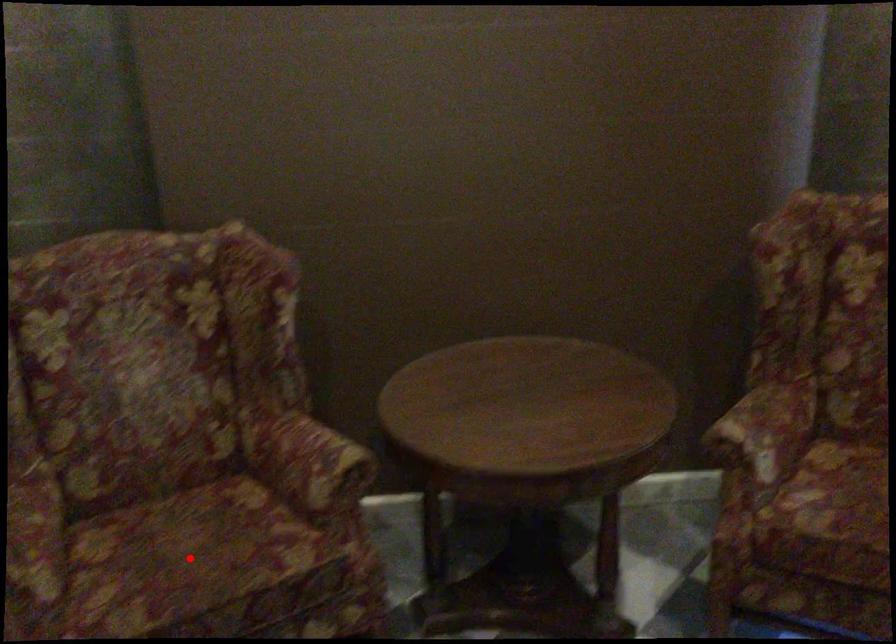
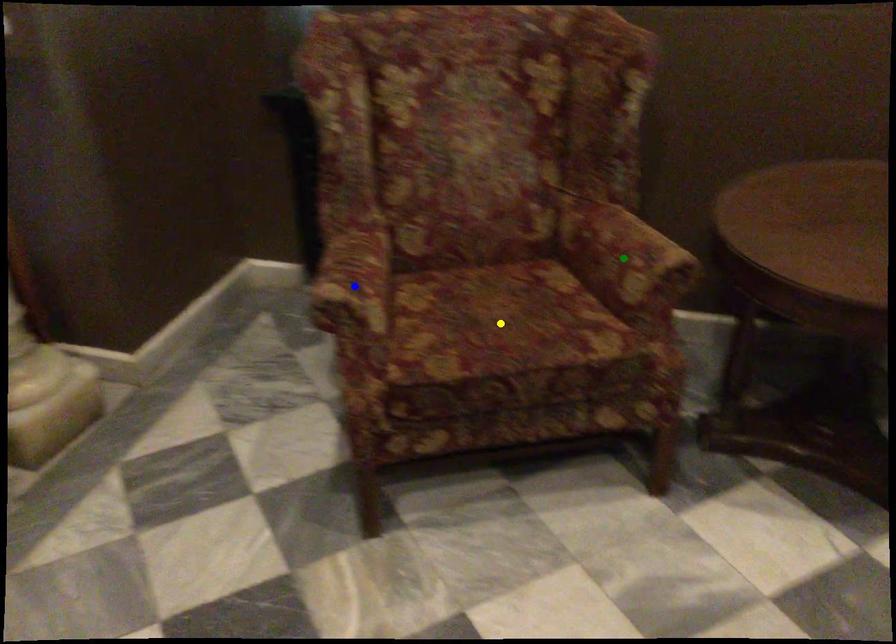
Question: I am providing you with two images of the same scene from different viewpoints. A red point is marked on the first image. You are given multiple points on the second image. Which spot in image 2 lines up with the point in image 1?

Choices:
 (A) blue point
 (B) yellow point
 (C) green point

Answer: (B)